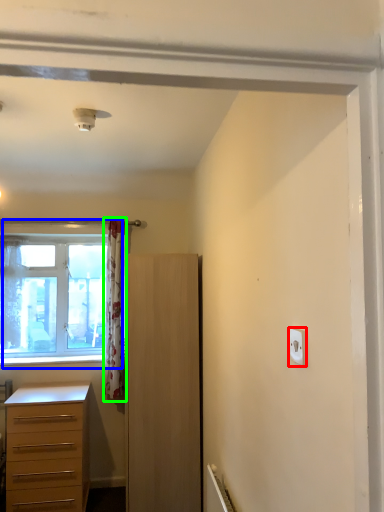
Question: Considering the real-world distances, which object is closest to light switch (highlighted by a red box)? window (highlighted by a blue box) or curtain (highlighted by a green box).

Choices:
 (A) window
 (B) curtain

Answer: (B)